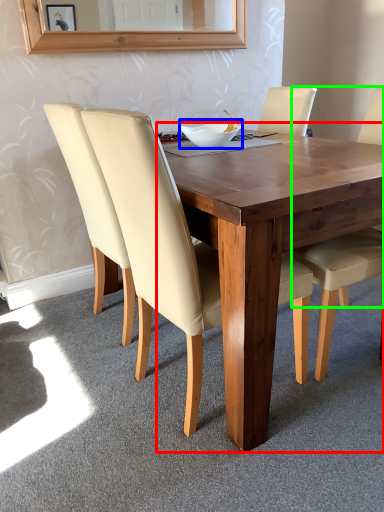
Question: Which object is positioned closest to round table (highlighted by a red box)? Select from bowl (highlighted by a blue box) and chair (highlighted by a green box).

Choices:
 (A) bowl
 (B) chair

Answer: (B)